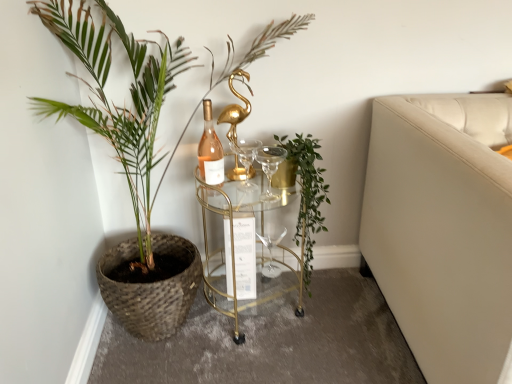
This screenshot has width=512, height=384. What do you see at coordinates (210, 150) in the screenshot?
I see `matte glass wine bottle at center` at bounding box center [210, 150].

This screenshot has width=512, height=384. I want to click on matte glass wine bottle at center, so click(x=210, y=150).

In order to face clear glass wine glass at center, the 2th wine glass ordered from the bottom, should I rotate leftwards or rightwards?

Rotate your view left by about 1.083°.

Locate an element on the screen. green woven basket at left, the 2th houseplant from the right is located at coordinates (129, 153).

Measure the distance between green woven basket at left, the 1th houseplant when ordered from left to right, and camera.

3.54 feet.

Identify the location of green leafy plant at center, which ranks as the first houseplant in right-to-left order. (307, 194).

Identify the location of gold glass table at center. (237, 254).

The height and width of the screenshot is (384, 512). I want to click on matte glass wine bottle at center, so click(x=210, y=150).

The width and height of the screenshot is (512, 384). In order to click on houseplant that is the 1st object located above the gold glass table at center (from the image's perspective) in this screenshot , I will do [307, 194].

Does gold glass table at center have a smaller size compared to green leafy plant at center, which ranks as the first houseplant in right-to-left order?

No.

Looking at this image, is gold glass table at center not inside green leafy plant at center, which ranks as the first houseplant in right-to-left order?

Yes, gold glass table at center is not within green leafy plant at center, which ranks as the first houseplant in right-to-left order.

Based on the photo, between green woven basket at left, the 2th houseplant from the right, and matte glass wine bottle at center, which one has smaller size?

With smaller size is matte glass wine bottle at center.

From the image's perspective, is green woven basket at left, the 1th houseplant when ordered from left to right, above or below matte glass wine bottle at center?

green woven basket at left, the 1th houseplant when ordered from left to right, is situated lower than matte glass wine bottle at center in the image.

Is green woven basket at left, the 1th houseplant when ordered from left to right, thinner than matte glass wine bottle at center?

In fact, green woven basket at left, the 1th houseplant when ordered from left to right, might be wider than matte glass wine bottle at center.

Is green woven basket at left, the 2th houseplant from the right, further to camera compared to matte glass wine bottle at center?

No, the depth of green woven basket at left, the 2th houseplant from the right, is less than that of matte glass wine bottle at center.

Considering the positions of objects clear glass wine glass at center, the 2th wine glass ordered from the bottom, and matte glass wine bottle at center in the image provided, who is more to the right, clear glass wine glass at center, the 2th wine glass ordered from the bottom, or matte glass wine bottle at center?

clear glass wine glass at center, the 2th wine glass ordered from the bottom.

Which object is further away from the camera, clear glass wine glass at center, which is the second wine glass in back-to-front order, or matte glass wine bottle at center?

clear glass wine glass at center, which is the second wine glass in back-to-front order, is behind.

How many degrees apart are the facing directions of clear glass wine glass at center, the 2th wine glass ordered from the bottom, and matte glass wine bottle at center?

The angular difference between clear glass wine glass at center, the 2th wine glass ordered from the bottom, and matte glass wine bottle at center is 8.9e-05 degrees.

From the image's perspective, does clear glass wine glass at center, the 2th wine glass ordered from the bottom, appear lower than matte glass wine bottle at center?

Indeed, from the image's perspective, clear glass wine glass at center, the 2th wine glass ordered from the bottom, is shown beneath matte glass wine bottle at center.

From the picture: In terms of size, does clear glass wine glass at center, the 2th wine glass ordered from the bottom, appear bigger or smaller than green leafy plant at center, which ranks as the 2th houseplant in left-to-right order?

In the image, clear glass wine glass at center, the 2th wine glass ordered from the bottom, appears to be smaller than green leafy plant at center, which ranks as the 2th houseplant in left-to-right order.

Is clear glass wine glass at center, which is the second wine glass in back-to-front order, positioned with its back to green leafy plant at center, which ranks as the 2th houseplant in left-to-right order?

clear glass wine glass at center, which is the second wine glass in back-to-front order, does not have its back to green leafy plant at center, which ranks as the 2th houseplant in left-to-right order.

From the image's perspective, between green leafy plant at center, which ranks as the first houseplant in right-to-left order, and clear glass wine glass at center, which is the second wine glass in back-to-front order, who is located below?

green leafy plant at center, which ranks as the first houseplant in right-to-left order, appears lower in the image.

Is green leafy plant at center, which ranks as the first houseplant in right-to-left order, to the left or to the right of clear glass wine glass at center, which is the second wine glass in back-to-front order, in the image?

green leafy plant at center, which ranks as the first houseplant in right-to-left order, is positioned on clear glass wine glass at center, which is the second wine glass in back-to-front order,'s right side.

Is green leafy plant at center, which ranks as the first houseplant in right-to-left order, facing away from clear glass wine glass at center, the 1th wine glass viewed from the top?

That's not correct — green leafy plant at center, which ranks as the first houseplant in right-to-left order, is not looking away from clear glass wine glass at center, the 1th wine glass viewed from the top.

Between point (308, 245) and point (236, 171), which one is positioned in front?

Point (236, 171)

Can you tell me how much green leafy plant at center, which ranks as the 2th houseplant in left-to-right order, and transparent glass wine glass at center, which is the first wine glass in back-to-front order, differ in facing direction?

The angular difference between green leafy plant at center, which ranks as the 2th houseplant in left-to-right order, and transparent glass wine glass at center, which is the first wine glass in back-to-front order, is 0.000852 degrees.

Locate an element on the screen. wine glass below the green leafy plant at center, which ranks as the 2th houseplant in left-to-right order (from the image's perspective) is located at coordinates (271, 253).

Is green leafy plant at center, which ranks as the first houseplant in right-to-left order, bigger than transparent glass wine glass at center, which is the first wine glass in bottom-to-top order?

Yes, green leafy plant at center, which ranks as the first houseplant in right-to-left order, is bigger than transparent glass wine glass at center, which is the first wine glass in bottom-to-top order.

Is green leafy plant at center, which ranks as the 2th houseplant in left-to-right order, beside transparent glass wine glass at center, which is the first wine glass in back-to-front order?

No, green leafy plant at center, which ranks as the 2th houseplant in left-to-right order, is not beside transparent glass wine glass at center, which is the first wine glass in back-to-front order.

Who is shorter, transparent glass wine glass at center, positioned as the 2th wine glass in top-to-bottom order, or green leafy plant at center, which ranks as the first houseplant in right-to-left order?

Standing shorter between the two is transparent glass wine glass at center, positioned as the 2th wine glass in top-to-bottom order.

Considering the sizes of objects transparent glass wine glass at center, which is the first wine glass in bottom-to-top order, and green leafy plant at center, which ranks as the 2th houseplant in left-to-right order, in the image provided, who is smaller, transparent glass wine glass at center, which is the first wine glass in bottom-to-top order, or green leafy plant at center, which ranks as the 2th houseplant in left-to-right order,?

transparent glass wine glass at center, which is the first wine glass in bottom-to-top order.

From the picture: Is transparent glass wine glass at center, which is the first wine glass in bottom-to-top order, wider than green leafy plant at center, which ranks as the first houseplant in right-to-left order?

Incorrect, the width of transparent glass wine glass at center, which is the first wine glass in bottom-to-top order, does not surpass that of green leafy plant at center, which ranks as the first houseplant in right-to-left order.

From the picture: Is transparent glass wine glass at center, positioned as the 2th wine glass in top-to-bottom order, not inside green leafy plant at center, which ranks as the first houseplant in right-to-left order?

No, most part of transparent glass wine glass at center, positioned as the 2th wine glass in top-to-bottom order, lies within green leafy plant at center, which ranks as the first houseplant in right-to-left order.

You are a GUI agent. You are given a task and a screenshot of the screen. Output one action in this format:
    pyautogui.click(x=<x>, y=<y>)
    Task: Click on the table below the green leafy plant at center, which ranks as the first houseplant in right-to-left order (from the image's perspective)
    The height and width of the screenshot is (384, 512).
    Given the screenshot: What is the action you would take?
    pyautogui.click(x=237, y=254)

Where is `wine bottle on the right of green woven basket at left, the 2th houseplant from the right`? wine bottle on the right of green woven basket at left, the 2th houseplant from the right is located at coordinates (210, 150).

Estimate the real-world distances between objects in this image. Which object is closer to clear glass wine glass at center, which is the second wine glass in back-to-front order, green leafy plant at center, which ranks as the 2th houseplant in left-to-right order, or gold glass table at center?

Based on the image, green leafy plant at center, which ranks as the 2th houseplant in left-to-right order, appears to be nearer to clear glass wine glass at center, which is the second wine glass in back-to-front order.

From the image, which object appears to be nearer to clear glass wine glass at center, which is the second wine glass in back-to-front order, green leafy plant at center, which ranks as the first houseplant in right-to-left order, or matte glass wine bottle at center?

matte glass wine bottle at center lies closer to clear glass wine glass at center, which is the second wine glass in back-to-front order, than the other object.

When comparing their distances from matte glass wine bottle at center, does green leafy plant at center, which ranks as the 2th houseplant in left-to-right order, or gold glass table at center seem closer?

gold glass table at center is positioned closer to the anchor matte glass wine bottle at center.

Looking at the image, which one is located closer to transparent glass wine glass at center, which is the first wine glass in bottom-to-top order, matte glass wine bottle at center or green leafy plant at center, which ranks as the 2th houseplant in left-to-right order?

Among the two, green leafy plant at center, which ranks as the 2th houseplant in left-to-right order, is located nearer to transparent glass wine glass at center, which is the first wine glass in bottom-to-top order.

From the image, which object appears to be nearer to green woven basket at left, the 2th houseplant from the right, transparent glass wine glass at center, which is the first wine glass in bottom-to-top order, or matte glass wine bottle at center?

matte glass wine bottle at center.

Based on their spatial positions, is matte glass wine bottle at center or clear glass wine glass at center, which is the second wine glass in back-to-front order, closer to green leafy plant at center, which ranks as the 2th houseplant in left-to-right order?

clear glass wine glass at center, which is the second wine glass in back-to-front order, lies closer to green leafy plant at center, which ranks as the 2th houseplant in left-to-right order, than the other object.

When comparing their distances from matte glass wine bottle at center, does clear glass wine glass at center, the 2th wine glass ordered from the bottom, or green woven basket at left, the 2th houseplant from the right, seem further?

Among the two, green woven basket at left, the 2th houseplant from the right, is located further to matte glass wine bottle at center.

Considering their positions, is green leafy plant at center, which ranks as the 2th houseplant in left-to-right order, positioned closer to matte glass wine bottle at center than clear glass wine glass at center, acting as the 1th wine glass starting from the front?

The object closer to matte glass wine bottle at center is clear glass wine glass at center, acting as the 1th wine glass starting from the front.

Image resolution: width=512 pixels, height=384 pixels. I want to click on houseplant between green woven basket at left, the 1th houseplant when ordered from left to right, and matte glass wine bottle at center in the front-back direction, so tap(307, 194).

Locate an element on the screen. The height and width of the screenshot is (384, 512). wine glass between gold glass table at center and transparent glass wine glass at center, which is the first wine glass in bottom-to-top order, in the front-back direction is located at coordinates (243, 159).

The image size is (512, 384). I want to click on houseplant between gold glass table at center and transparent glass wine glass at center, which is the first wine glass in bottom-to-top order, from front to back, so click(307, 194).

Find the location of `wine glass between matte glass wine bottle at center and gold glass table at center in the vertical direction`. wine glass between matte glass wine bottle at center and gold glass table at center in the vertical direction is located at coordinates (243, 159).